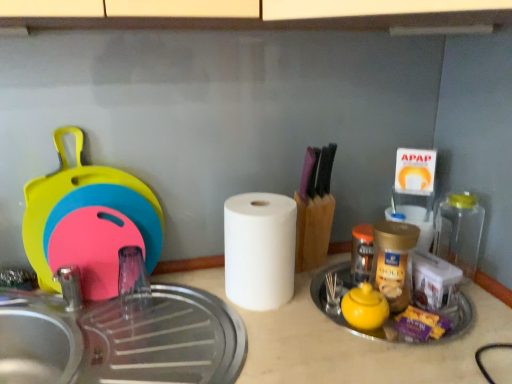
Where is `vacant area that lies in front of transparent plastic faucet at left`? vacant area that lies in front of transparent plastic faucet at left is located at coordinates (138, 345).